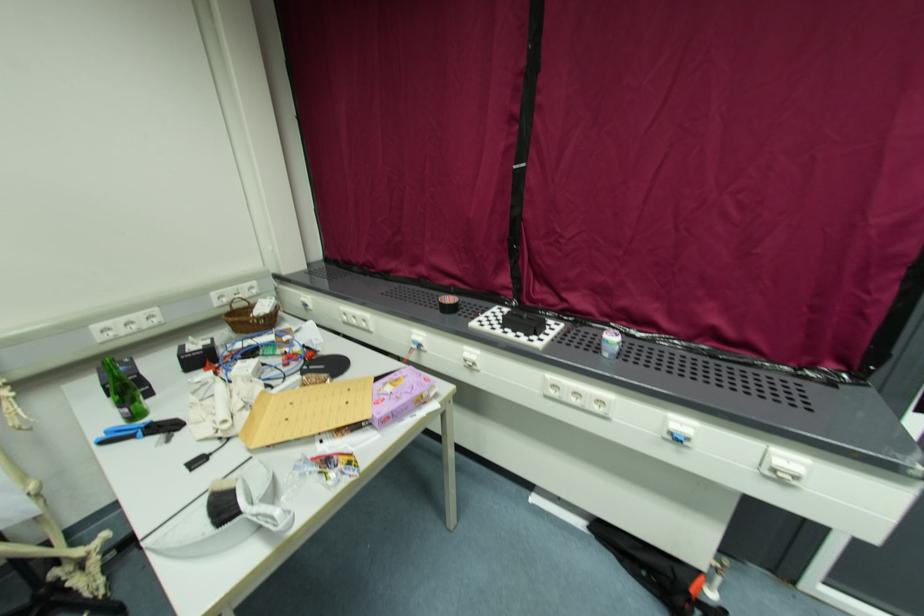
You are a GUI agent. You are given a task and a screenshot of the screen. Output one action in this format:
    pyautogui.click(x=<x>, y=<y>)
    Task: Click on the small wicker basket
    Image resolution: width=924 pixels, height=616 pixels.
    Given the screenshot: What is the action you would take?
    pyautogui.click(x=249, y=315)